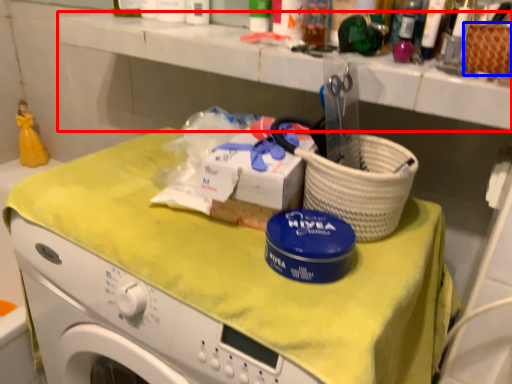
Question: Which object appears farthest to the camera in this image, counter top (highlighted by a red box) or basket (highlighted by a blue box)?

Choices:
 (A) counter top
 (B) basket

Answer: (A)